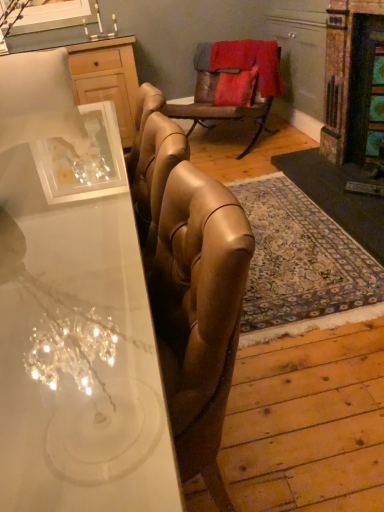
Question: Is white glossy desk at center looking in the opposite direction of wooden cabinet at upper left?

Choices:
 (A) no
 (B) yes

Answer: (A)

Question: Does white glossy desk at center contain wooden cabinet at upper left?

Choices:
 (A) yes
 (B) no

Answer: (B)

Question: Is white glossy desk at center directly adjacent to wooden cabinet at upper left?

Choices:
 (A) no
 (B) yes

Answer: (A)

Question: From a real-world perspective, does white glossy desk at center sit lower than wooden cabinet at upper left?

Choices:
 (A) yes
 (B) no

Answer: (A)

Question: Is white glossy desk at center not within wooden cabinet at upper left?

Choices:
 (A) no
 (B) yes

Answer: (B)

Question: Would you say white glossy desk at center is inside or outside wooden cabinet at upper left?

Choices:
 (A) outside
 (B) inside

Answer: (A)

Question: Considering the positions of white glossy desk at center and wooden cabinet at upper left in the image, is white glossy desk at center taller or shorter than wooden cabinet at upper left?

Choices:
 (A) tall
 (B) short

Answer: (B)

Question: Is point (0, 449) positioned closer to the camera than point (66, 71)?

Choices:
 (A) farther
 (B) closer

Answer: (B)

Question: Is white glossy desk at center in front of or behind wooden cabinet at upper left in the image?

Choices:
 (A) front
 (B) behind

Answer: (A)

Question: Is point (372, 68) closer or farther from the camera than point (243, 104)?

Choices:
 (A) closer
 (B) farther

Answer: (A)

Question: Based on their sizes in the image, would you say rustic stone fireplace at right is bigger or smaller than leather armchair at center?

Choices:
 (A) big
 (B) small

Answer: (B)

Question: Is rustic stone fireplace at right taller or shorter than leather armchair at center?

Choices:
 (A) short
 (B) tall

Answer: (B)

Question: In the image, is rustic stone fireplace at right positioned in front of or behind leather armchair at center?

Choices:
 (A) behind
 (B) front

Answer: (B)

Question: From the image's perspective, is white glossy desk at center located above or below rustic stone fireplace at right?

Choices:
 (A) above
 (B) below

Answer: (B)

Question: Considering the positions of white glossy desk at center and rustic stone fireplace at right in the image, is white glossy desk at center wider or thinner than rustic stone fireplace at right?

Choices:
 (A) thin
 (B) wide

Answer: (B)